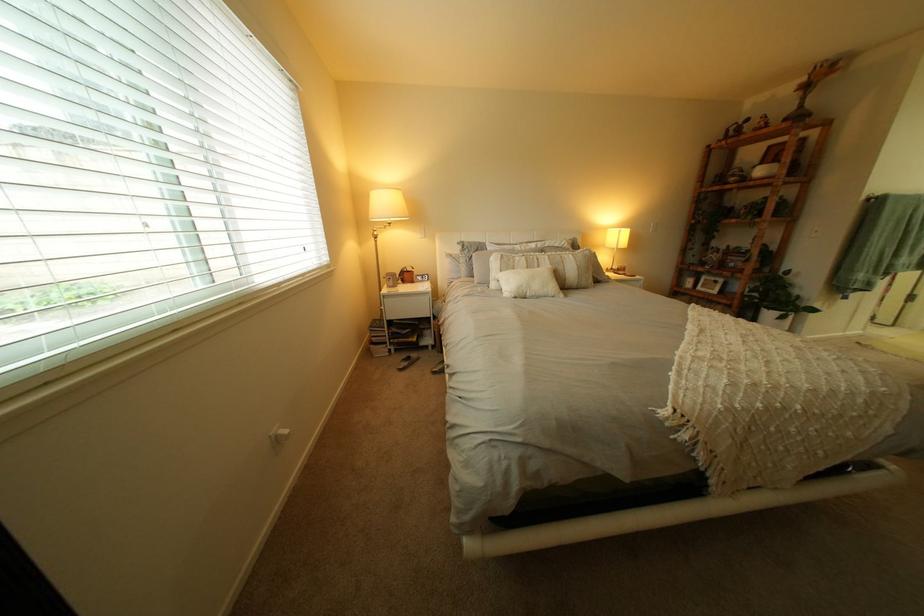
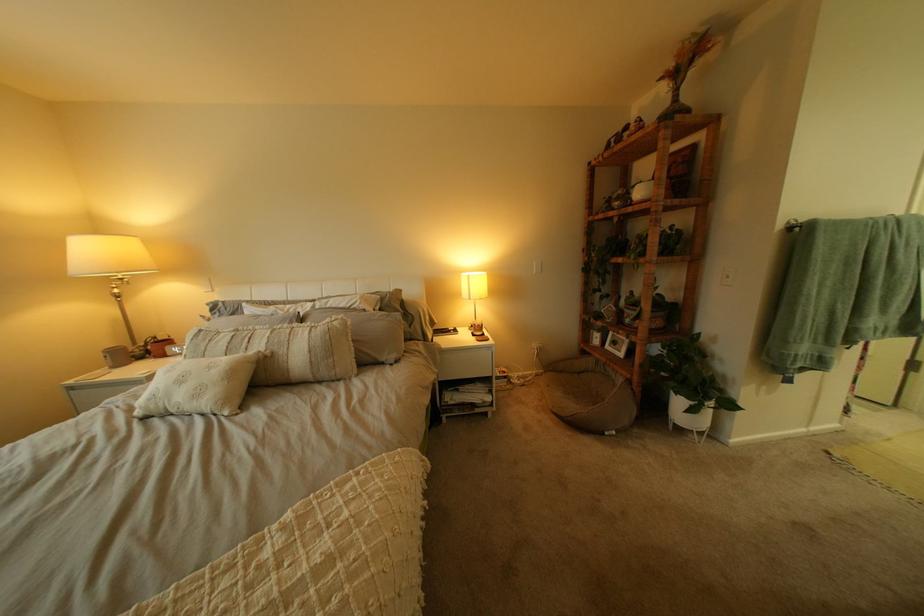
In the second image, find the point that corresponds to point 782,305 in the first image.

(687, 385)